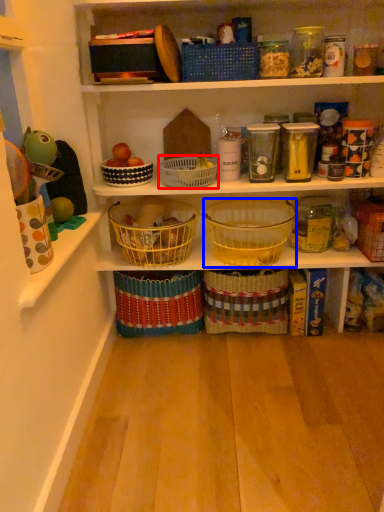
Question: Which of the following is the farthest to the observer, basket (highlighted by a red box) or basket (highlighted by a blue box)?

Choices:
 (A) basket
 (B) basket

Answer: (A)